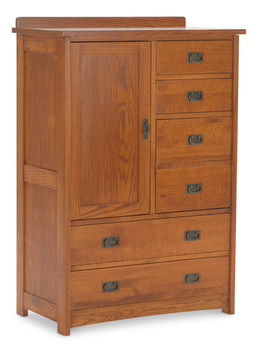
Identify the location of wardrobe. (115, 28).